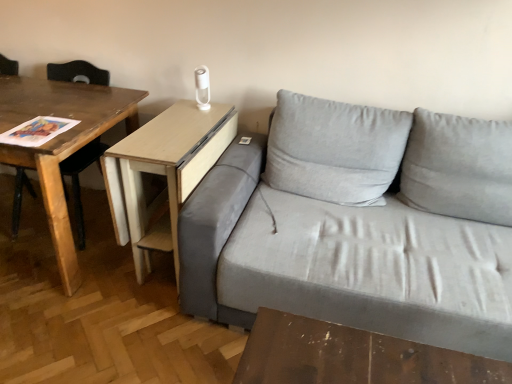
Locate an element on the screen. This screenshot has height=384, width=512. free space in front of light wood/woodenobject at center, which appears as the second table when viewed from the left is located at coordinates (137, 332).